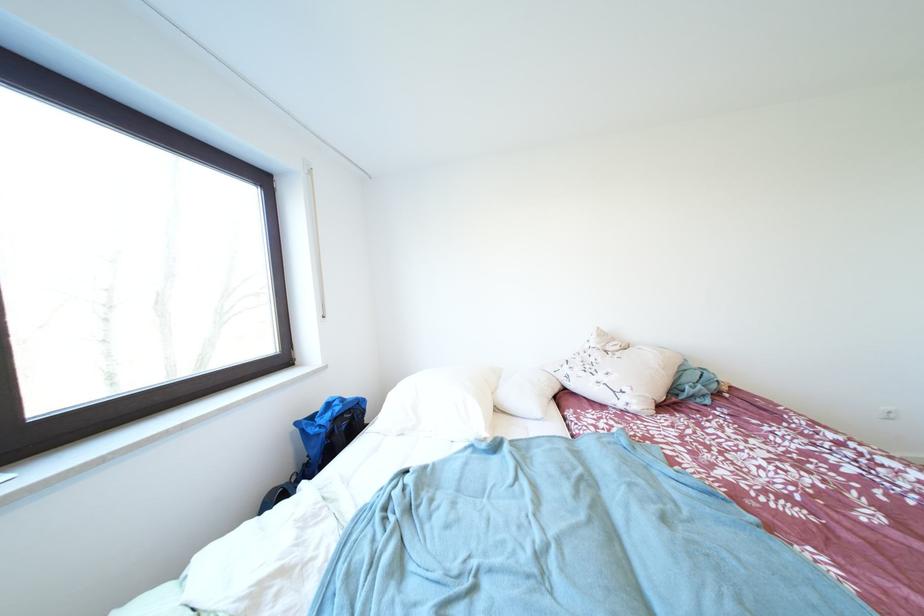
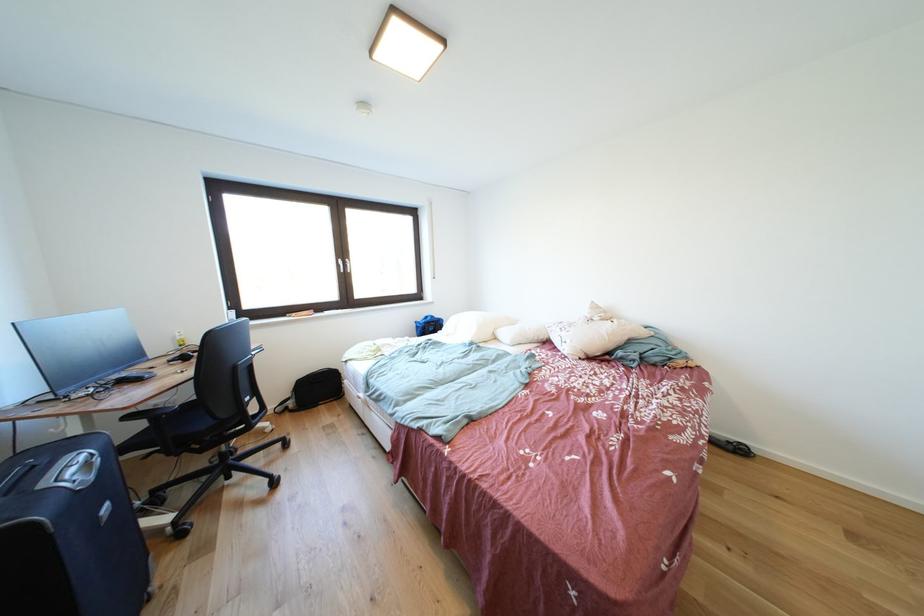
Locate, in the second image, the point that corresponds to point 610,382 in the first image.

(572, 338)